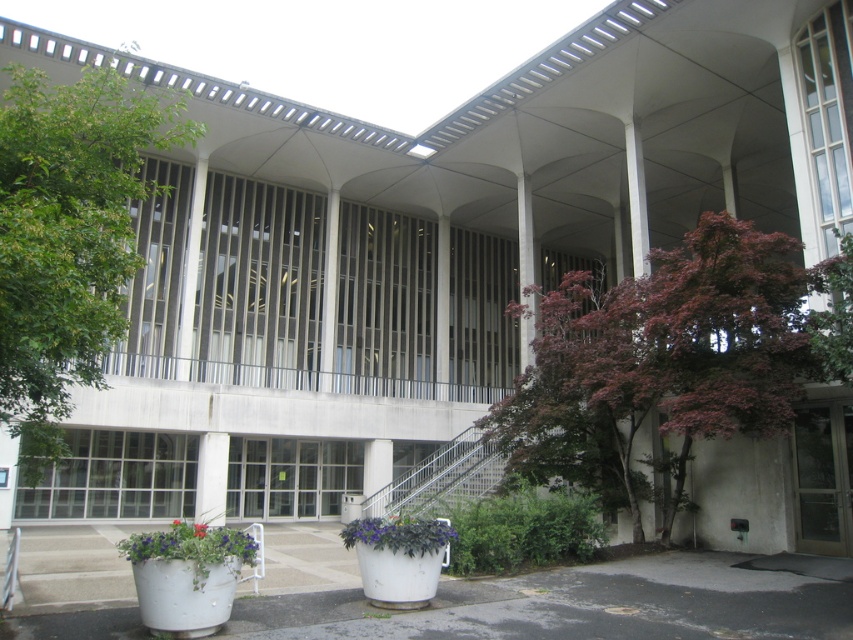
Question: Which of these objects is positioned farthest from the purple leafy tree at upper right?

Choices:
 (A) green leafy tree at left
 (B) matte glass door at lower right

Answer: (A)

Question: Is matte glass door at lower right positioned behind metallic gray staircase at center?

Choices:
 (A) no
 (B) yes

Answer: (A)

Question: Which point is farther to the camera?

Choices:
 (A) (108, 193)
 (B) (469, 483)
 (C) (195, 529)
 (D) (178, 522)

Answer: (B)

Question: Which of the following is the closest to the observer?

Choices:
 (A) [x=843, y=513]
 (B) [x=198, y=531]
 (C) [x=396, y=540]
 (D) [x=103, y=266]

Answer: (D)

Question: Does white concrete stairs at lower center have a larger size compared to red matte flower at center?

Choices:
 (A) yes
 (B) no

Answer: (A)

Question: Can you confirm if green leafy tree at left is wider than white concrete stairs at lower center?

Choices:
 (A) yes
 (B) no

Answer: (A)